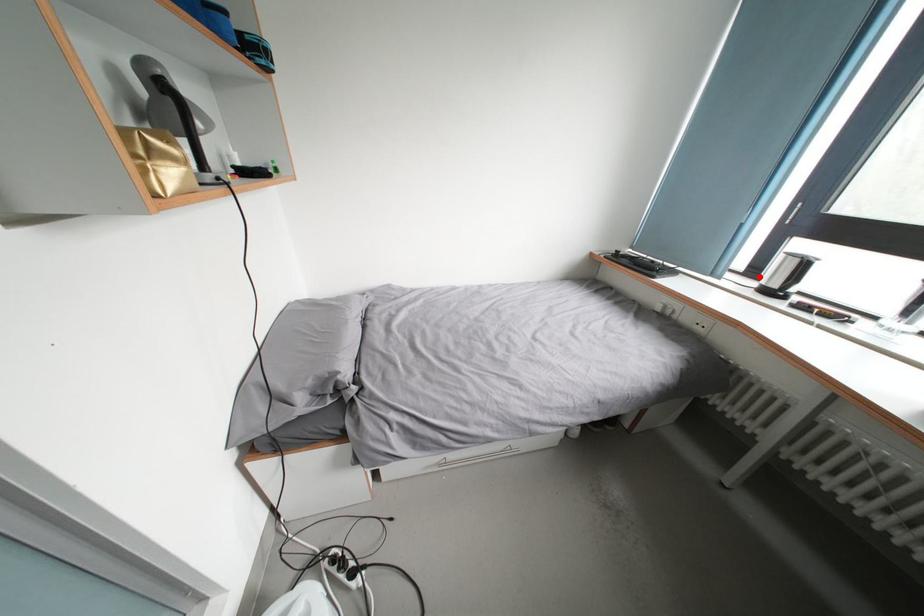
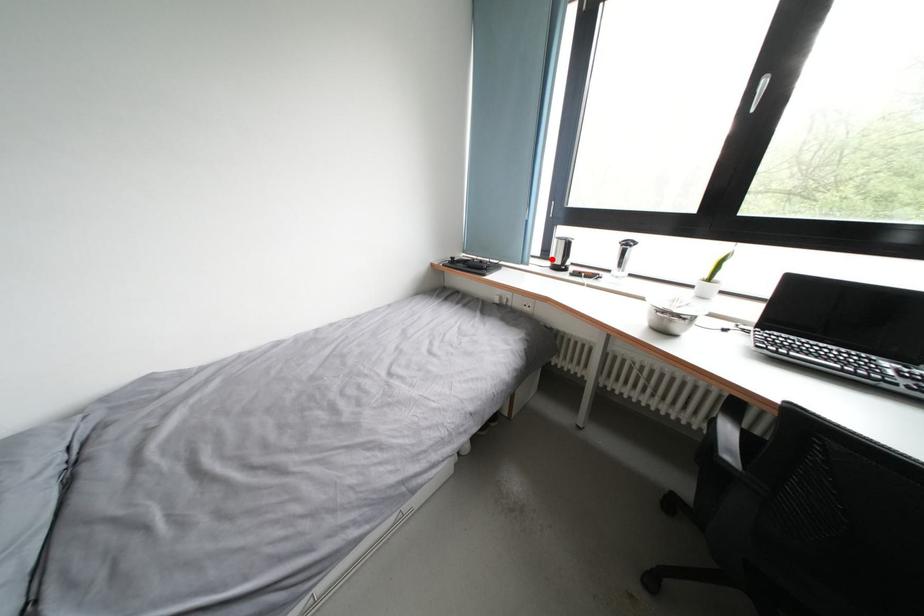
I am providing you with two images of the same scene from different viewpoints. A red point is marked on the first image and another point is marked on the second image. Is the red point in image1 aligned with the point shown in image2?

Yes